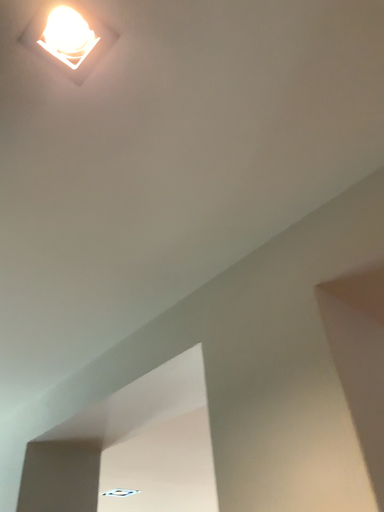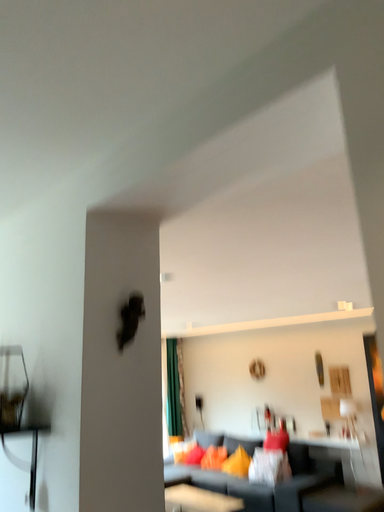
Question: Which way did the camera rotate in the video?

Choices:
 (A) rotated downward
 (B) rotated upward

Answer: (A)